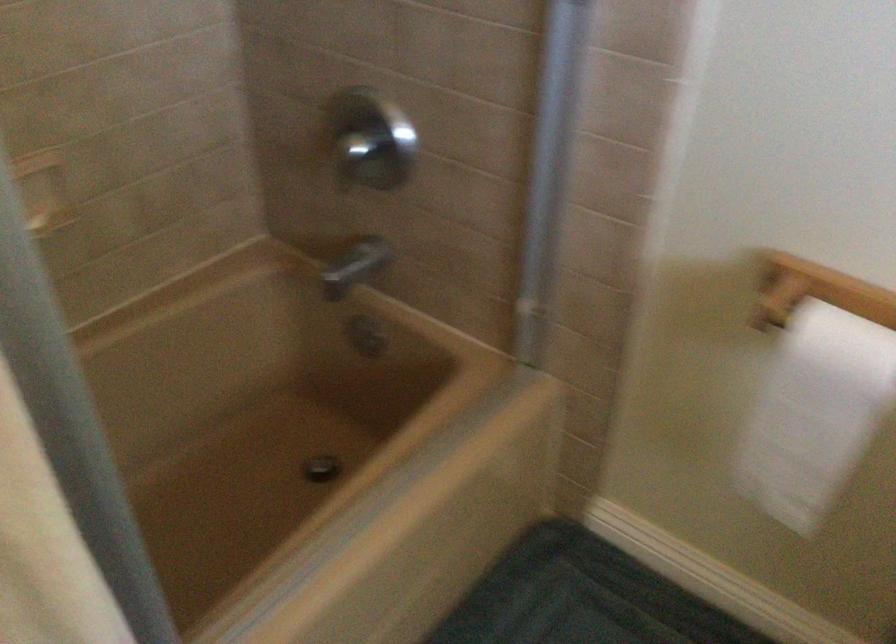
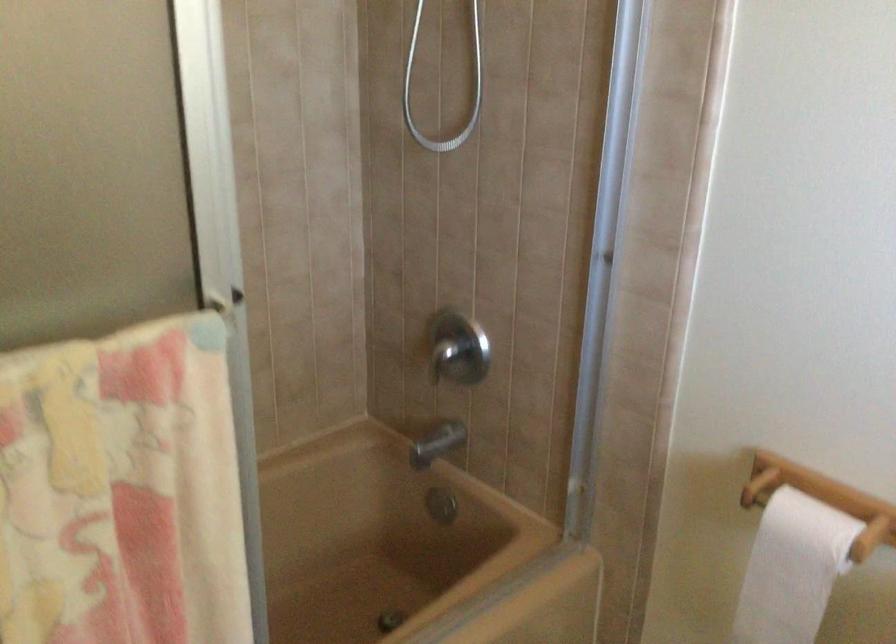
In the second image, find the point that corresponds to (x=816, y=406) in the first image.

(791, 569)